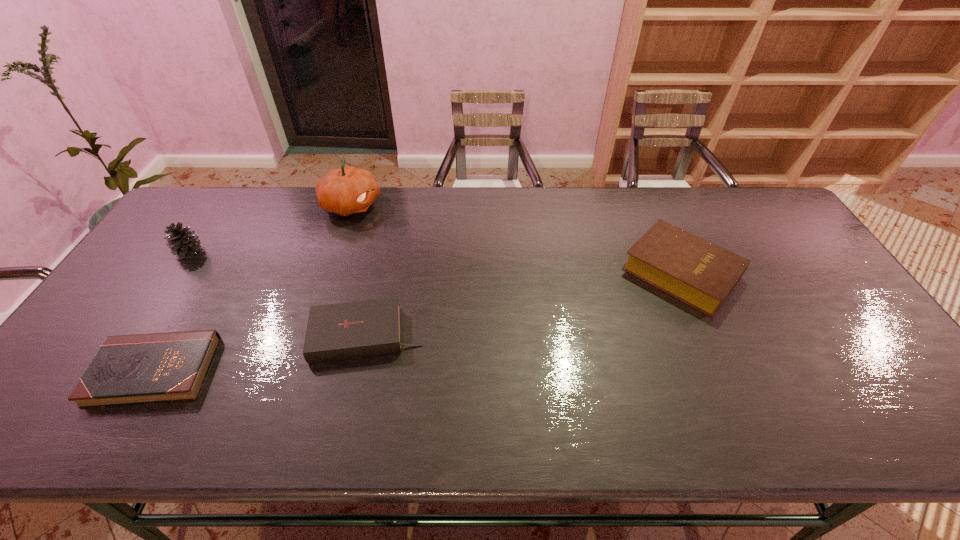
The width and height of the screenshot is (960, 540). Identify the location of the tallest object. (349, 190).

Find the location of `the farthest object`. the farthest object is located at coordinates (349, 190).

The height and width of the screenshot is (540, 960). Find the location of `pinecone`. pinecone is located at coordinates (182, 241).

In order to click on the third shortest object in this screenshot , I will do `click(693, 270)`.

Locate an element on the screen. the rightmost Bible is located at coordinates (693, 270).

Find the location of `the second Bible from left to right`. the second Bible from left to right is located at coordinates point(348,330).

Locate an element on the screen. The width and height of the screenshot is (960, 540). the shortest Bible is located at coordinates (158, 367).

Locate an element on the screen. the shortest object is located at coordinates (158, 367).

Locate an element on the screen. This screenshot has height=540, width=960. vacant space located on the front face of the tallest object is located at coordinates (453, 205).

At what (x,y) coordinates should I click in order to perform the action: click on vacant area situated 0.180m on the front of the pinecone. Please return your answer as a coordinate pair (x, y). The height and width of the screenshot is (540, 960). Looking at the image, I should click on (152, 308).